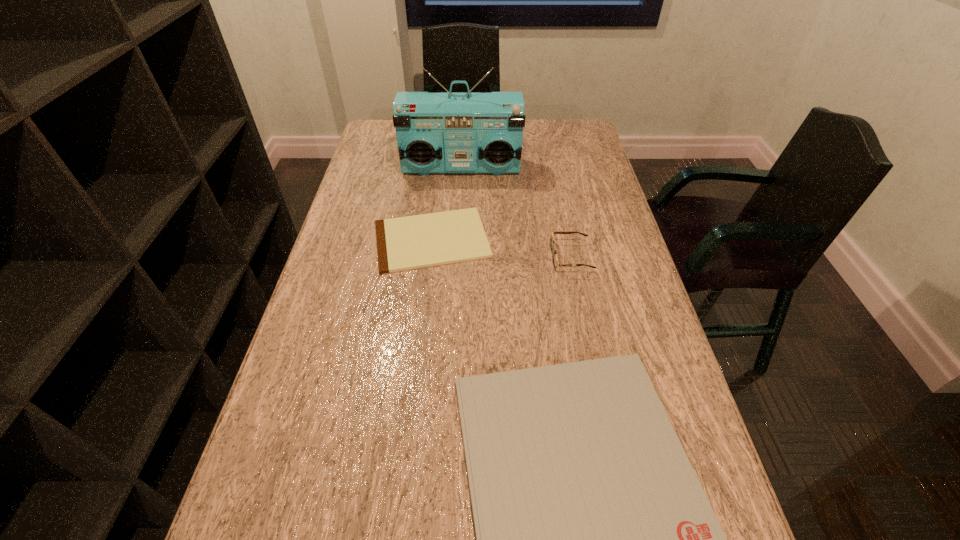
The height and width of the screenshot is (540, 960). In order to click on radio receiver in this screenshot , I will do `click(445, 132)`.

This screenshot has height=540, width=960. Identify the location of the tallest object. (445, 132).

Locate an element on the screen. The image size is (960, 540). the second tallest object is located at coordinates (555, 260).

Where is `the shortest object`? The image size is (960, 540). the shortest object is located at coordinates (412, 242).

I want to click on the shorter clipboard, so [412, 242].

You are a GUI agent. You are given a task and a screenshot of the screen. Output one action in this format:
    pyautogui.click(x=<x>, y=<y>)
    Task: Click on the free region located on the front-facing side of the farthest object
    The height and width of the screenshot is (540, 960).
    Given the screenshot: What is the action you would take?
    pyautogui.click(x=457, y=262)

Image resolution: width=960 pixels, height=540 pixels. Identify the location of free space located 0.080m on the frame of the spectacles. point(521,257).

Where is `free space located 0.360m on the frame of the spectacles`? The width and height of the screenshot is (960, 540). free space located 0.360m on the frame of the spectacles is located at coordinates (415, 257).

Locate an element on the screen. This screenshot has width=960, height=540. blank area located on the frame of the spectacles is located at coordinates (483, 257).

At what (x,y) coordinates should I click in order to perform the action: click on blank area located 0.300m on the front of the shorter clipboard. Please return your answer as a coordinate pair (x, y). The width and height of the screenshot is (960, 540). Looking at the image, I should click on (416, 379).